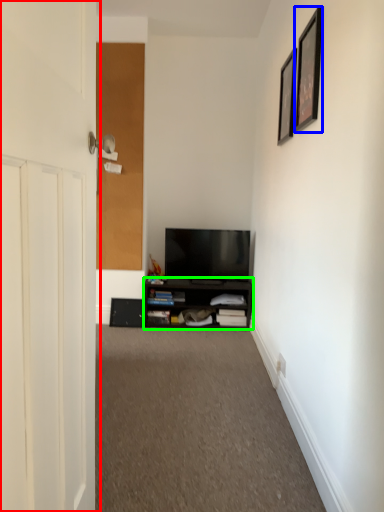
Question: Estimate the real-world distances between objects in this image. Which object is farther from door (highlighted by a red box), picture frame (highlighted by a blue box) or cabinetry (highlighted by a green box)?

Choices:
 (A) picture frame
 (B) cabinetry

Answer: (B)